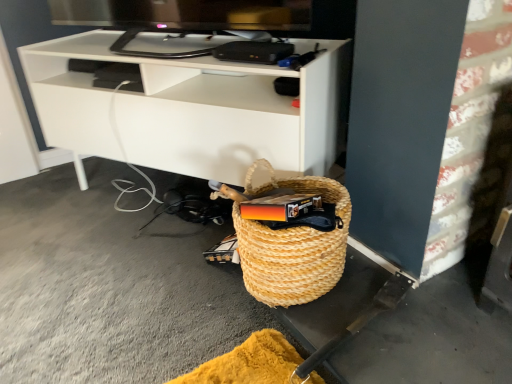
Question: Is white matte shelf at center bigger than woven straw basket at lower right?

Choices:
 (A) yes
 (B) no

Answer: (A)

Question: Does white matte shelf at center have a smaller size compared to woven straw basket at lower right?

Choices:
 (A) yes
 (B) no

Answer: (B)

Question: Is white matte shelf at center facing towards woven straw basket at lower right?

Choices:
 (A) no
 (B) yes

Answer: (B)

Question: Is white matte shelf at center further to camera compared to woven straw basket at lower right?

Choices:
 (A) no
 (B) yes

Answer: (B)

Question: Does white matte shelf at center have a lesser width compared to woven straw basket at lower right?

Choices:
 (A) yes
 (B) no

Answer: (B)

Question: Is white matte shelf at center looking in the opposite direction of woven straw basket at lower right?

Choices:
 (A) no
 (B) yes

Answer: (A)

Question: Is woven straw basket at lower right at the right side of white matte shelf at center?

Choices:
 (A) no
 (B) yes

Answer: (B)

Question: Is woven straw basket at lower right taller than white matte shelf at center?

Choices:
 (A) yes
 (B) no

Answer: (B)

Question: Does woven straw basket at lower right come behind white matte shelf at center?

Choices:
 (A) no
 (B) yes

Answer: (A)

Question: Does woven straw basket at lower right come in front of white matte shelf at center?

Choices:
 (A) yes
 (B) no

Answer: (A)

Question: Does woven straw basket at lower right contain white matte shelf at center?

Choices:
 (A) yes
 (B) no

Answer: (B)

Question: Can you confirm if woven straw basket at lower right is bigger than white matte shelf at center?

Choices:
 (A) yes
 (B) no

Answer: (B)

Question: From a real-world perspective, relative to white matte shelf at center, is woven straw basket at lower right vertically above or below?

Choices:
 (A) above
 (B) below

Answer: (B)